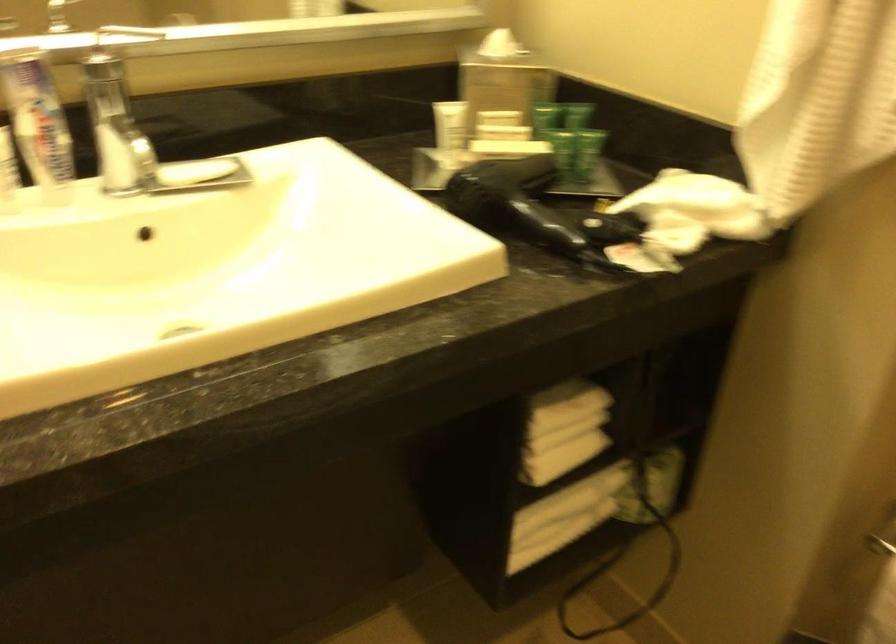
Image resolution: width=896 pixels, height=644 pixels. Describe the element at coordinates (101, 67) in the screenshot. I see `the metal faucet handle` at that location.